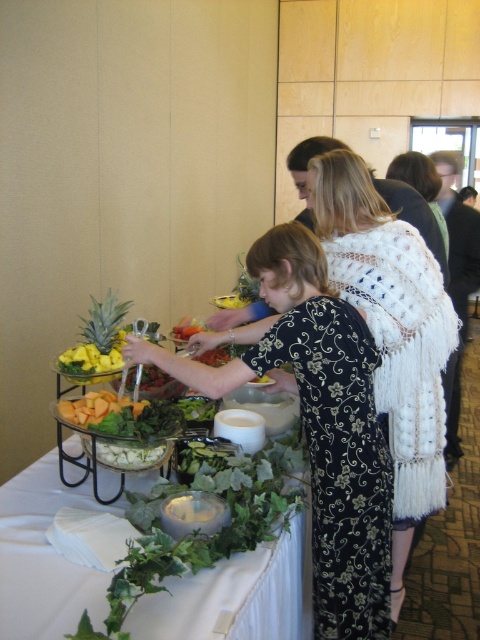
Is point (317, 358) more distant than point (116, 320)?

No, it is not.

Is black floral dress at center taller than green leafy pineapple at left?

Indeed, black floral dress at center has a greater height compared to green leafy pineapple at left.

Describe the element at coordinates (320, 426) in the screenshot. The height and width of the screenshot is (640, 480). I see `black floral dress at center` at that location.

In order to click on black floral dress at center in this screenshot , I will do `click(320, 426)`.

Who is shorter, black floral dress at center or green leafy salad at lower left?

Standing shorter between the two is green leafy salad at lower left.

Does point (325, 401) come closer to viewer compared to point (11, 545)?

No, (325, 401) is further to viewer.

Locate an element on the screen. This screenshot has width=480, height=640. black floral dress at center is located at coordinates (320, 426).

What do you see at coordinates (45, 557) in the screenshot? I see `green leafy salad at lower left` at bounding box center [45, 557].

Between green leafy salad at lower left and green leafy pineapple at left, which one is positioned higher?

green leafy pineapple at left is higher up.

Identify the location of green leafy salad at lower left. This screenshot has height=640, width=480. (45, 557).